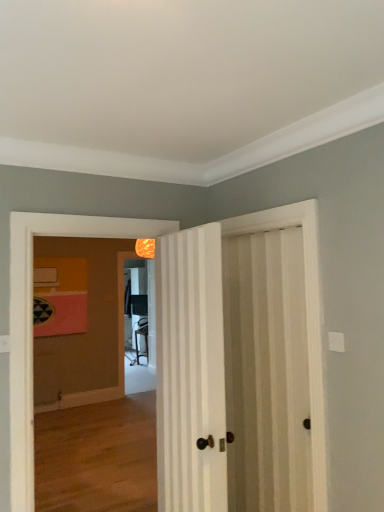
Question: From the image's perspective, is white striped door at right, acting as the second door starting from the left, above matte black screen door at center?

Choices:
 (A) no
 (B) yes

Answer: (B)

Question: Considering the relative positions of white striped door at right, acting as the second door starting from the left, and matte black screen door at center in the image provided, is white striped door at right, acting as the second door starting from the left, behind matte black screen door at center?

Choices:
 (A) yes
 (B) no

Answer: (B)

Question: From a real-world perspective, is white striped door at right, arranged as the first door when viewed from the right, located beneath matte black screen door at center?

Choices:
 (A) no
 (B) yes

Answer: (A)

Question: Considering the relative positions of white striped door at right, acting as the second door starting from the left, and matte black screen door at center in the image provided, is white striped door at right, acting as the second door starting from the left, in front of matte black screen door at center?

Choices:
 (A) no
 (B) yes

Answer: (B)

Question: Can you confirm if white striped door at right, acting as the second door starting from the left, is smaller than matte black screen door at center?

Choices:
 (A) yes
 (B) no

Answer: (A)

Question: From the image's perspective, is white striped door at right, arranged as the first door when viewed from the right, located above or below matte black screen door at center?

Choices:
 (A) below
 (B) above

Answer: (B)

Question: In the image, is white striped door at right, acting as the second door starting from the left, positioned in front of or behind matte black screen door at center?

Choices:
 (A) behind
 (B) front

Answer: (B)

Question: In terms of size, does white striped door at right, arranged as the first door when viewed from the right, appear bigger or smaller than matte black screen door at center?

Choices:
 (A) big
 (B) small

Answer: (B)

Question: Looking at their shapes, would you say white striped door at right, arranged as the first door when viewed from the right, is wider or thinner than matte black screen door at center?

Choices:
 (A) thin
 (B) wide

Answer: (A)

Question: Considering their positions, is matte black screen door at center located in front of or behind wooden floor at center?

Choices:
 (A) front
 (B) behind

Answer: (B)

Question: From their relative heights in the image, would you say matte black screen door at center is taller or shorter than wooden floor at center?

Choices:
 (A) tall
 (B) short

Answer: (A)

Question: From the image's perspective, is matte black screen door at center positioned above or below wooden floor at center?

Choices:
 (A) above
 (B) below

Answer: (B)

Question: Would you say matte black screen door at center is inside or outside wooden floor at center?

Choices:
 (A) outside
 (B) inside

Answer: (A)

Question: From their relative heights in the image, would you say white striped door at center, marked as the 1th door in a left-to-right arrangement, is taller or shorter than wooden floor at center?

Choices:
 (A) tall
 (B) short

Answer: (B)

Question: Is point (157, 348) closer or farther from the camera than point (109, 421)?

Choices:
 (A) farther
 (B) closer

Answer: (B)